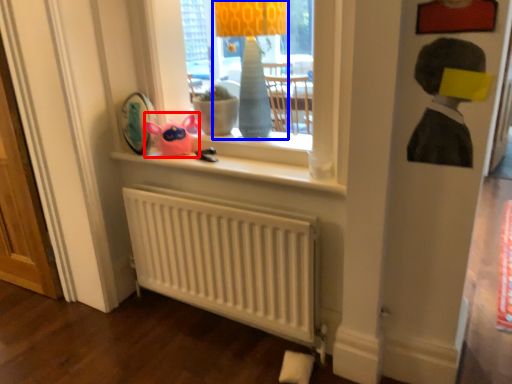
Question: Which point is further to the camera, toy (highlighted by a red box) or table lamp (highlighted by a blue box)?

Choices:
 (A) toy
 (B) table lamp

Answer: (A)